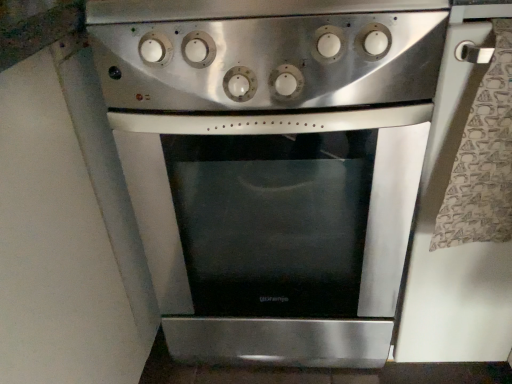
What do you see at coordinates (264, 53) in the screenshot?
I see `stainless steel oven at center` at bounding box center [264, 53].

Measure the distance between stainless steel oven at center and camera.

They are 21.60 inches apart.

You are a GUI agent. You are given a task and a screenshot of the screen. Output one action in this format:
    pyautogui.click(x=<x>, y=<y>)
    Task: Click on the stainless steel oven at center
    The width and height of the screenshot is (512, 384).
    Given the screenshot: What is the action you would take?
    pyautogui.click(x=264, y=53)

The image size is (512, 384). What do you see at coordinates (272, 165) in the screenshot?
I see `stainless steel oven at center` at bounding box center [272, 165].

In the scene shown: What is the approximate width of stainless steel oven at center?

stainless steel oven at center is 26.23 inches in width.

Identify the location of stainless steel oven at center. The image size is (512, 384). (272, 165).

In order to face stainless steel oven at center, should I rotate leftwards or rightwards?

It's best to rotate right around 1.802 degrees.

Measure the distance between point (180, 164) and camera.

The distance of point (180, 164) from camera is 29.21 inches.

Locate an element on the screen. The image size is (512, 384). stainless steel oven at center is located at coordinates 264,53.

Is stainless steel oven at center to the left or to the right of stainless steel oven at center in the image?

Based on their positions, stainless steel oven at center is located to the left of stainless steel oven at center.

Between stainless steel oven at center and stainless steel oven at center, which one is positioned behind?

stainless steel oven at center is further from the camera.

Which is in front, point (217, 91) or point (238, 73)?

The point (238, 73) is in front.

From the image's perspective, would you say stainless steel oven at center is shown under stainless steel oven at center?

Actually, stainless steel oven at center appears above stainless steel oven at center in the image.

In the scene shown: From a real-world perspective, is stainless steel oven at center on stainless steel oven at center?

Yes, from a real-world perspective, stainless steel oven at center is on top of stainless steel oven at center.

From the picture: Looking at their sizes, would you say stainless steel oven at center is wider or thinner than stainless steel oven at center?

Clearly, stainless steel oven at center has less width compared to stainless steel oven at center.

Which of these two, stainless steel oven at center or stainless steel oven at center, stands taller?

stainless steel oven at center.

Based on their sizes in the image, would you say stainless steel oven at center is bigger or smaller than stainless steel oven at center?

stainless steel oven at center is smaller than stainless steel oven at center.

Is stainless steel oven at center inside or outside of stainless steel oven at center?

stainless steel oven at center cannot be found inside stainless steel oven at center.

Is stainless steel oven at center positioned far away from stainless steel oven at center?

No, stainless steel oven at center is in close proximity to stainless steel oven at center.

Is stainless steel oven at center oriented away from stainless steel oven at center?

No, stainless steel oven at center is not facing the opposite direction of stainless steel oven at center.

Can you tell me how much stainless steel oven at center and stainless steel oven at center differ in facing direction?

stainless steel oven at center and stainless steel oven at center are facing 0.000577 degrees away from each other.

Image resolution: width=512 pixels, height=384 pixels. What are the coordinates of `gas stove that appears in front of the stainless steel oven at center` in the screenshot? It's located at (264, 53).

Which object is positioned more to the left, stainless steel oven at center or stainless steel oven at center?

stainless steel oven at center is more to the left.

Which object is further away from the camera, stainless steel oven at center or stainless steel oven at center?

Positioned behind is stainless steel oven at center.

Which is in front, point (173, 70) or point (358, 87)?

The point (358, 87) is closer to the camera.

From the image's perspective, is stainless steel oven at center located above stainless steel oven at center?

No.

From a real-world perspective, is stainless steel oven at center beneath stainless steel oven at center?

Correct, in the physical world, stainless steel oven at center is lower than stainless steel oven at center.

Between stainless steel oven at center and stainless steel oven at center, which one has smaller width?

stainless steel oven at center.

Can you confirm if stainless steel oven at center is shorter than stainless steel oven at center?

No, stainless steel oven at center is not shorter than stainless steel oven at center.

Between stainless steel oven at center and stainless steel oven at center, which one has larger size?

Bigger between the two is stainless steel oven at center.

Is stainless steel oven at center a part of stainless steel oven at center?

No, stainless steel oven at center is not inside stainless steel oven at center.

Is there a large distance between stainless steel oven at center and stainless steel oven at center?

That's not correct — stainless steel oven at center is a little close to stainless steel oven at center.

Could you tell me if stainless steel oven at center is turned towards stainless steel oven at center?

No, stainless steel oven at center is not turned towards stainless steel oven at center.

Can you tell me how much stainless steel oven at center and stainless steel oven at center differ in facing direction?

stainless steel oven at center and stainless steel oven at center are facing 0.000577 degrees away from each other.

Measure the distance between stainless steel oven at center and stainless steel oven at center.

7.55 inches.

Locate an element on the screen. oven that appears behind the stainless steel oven at center is located at coordinates (272, 165).

You are a GUI agent. You are given a task and a screenshot of the screen. Output one action in this format:
    pyautogui.click(x=<x>, y=<y>)
    Task: Click on the oven below the stainless steel oven at center (from the image's perspective)
    The height and width of the screenshot is (384, 512).
    Given the screenshot: What is the action you would take?
    (x=272, y=165)

Locate an element on the screen. gas stove on the left side of stainless steel oven at center is located at coordinates (264, 53).